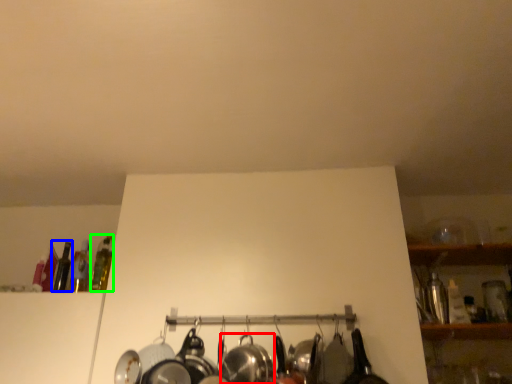
Question: Considering the real-world distances, which object is closest to wok (highlighted by a red box)? bottle (highlighted by a blue box) or bottle (highlighted by a green box).

Choices:
 (A) bottle
 (B) bottle

Answer: (B)